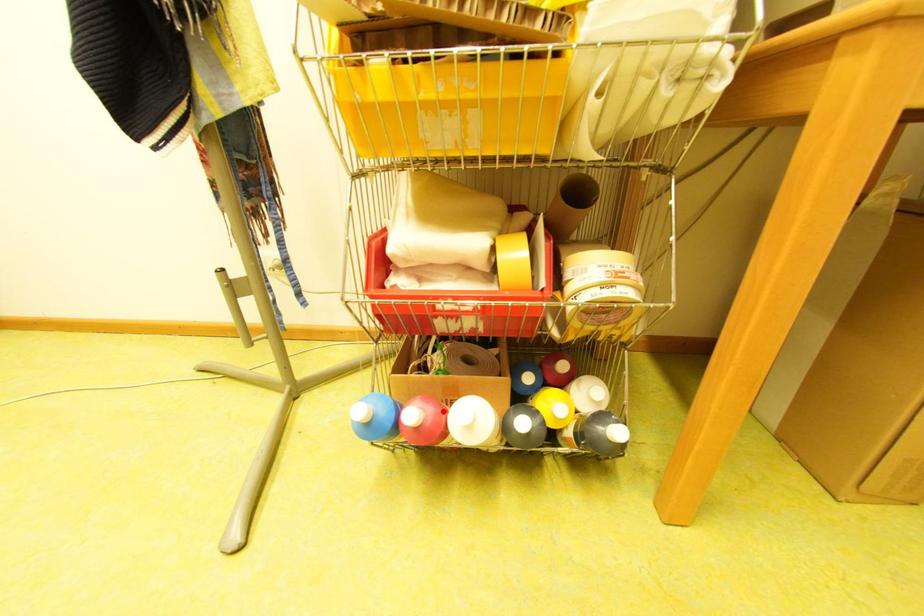
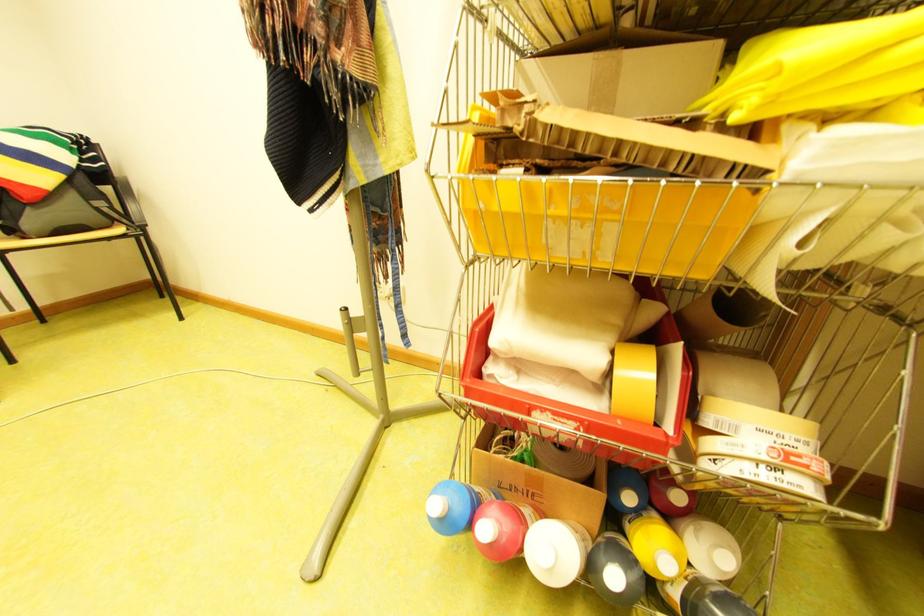
Find the pixel in the second image that matches the highlighted location in the first image.

(518, 525)